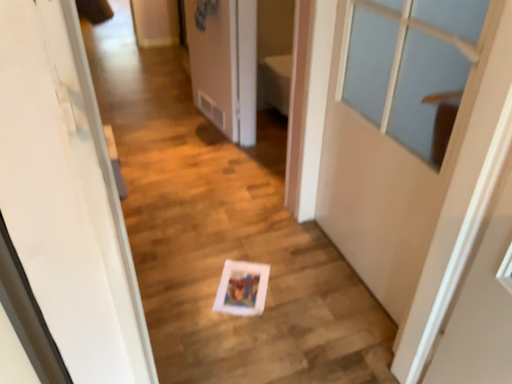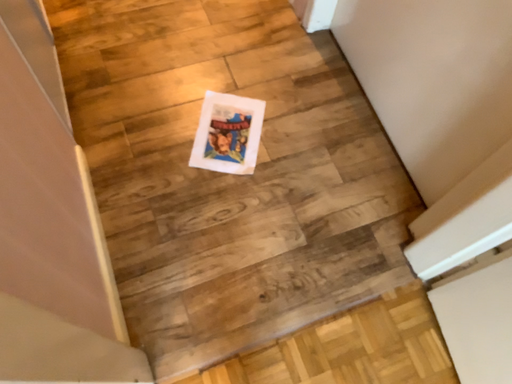
Question: How did the camera likely rotate when shooting the video?

Choices:
 (A) rotated downward
 (B) rotated upward

Answer: (A)